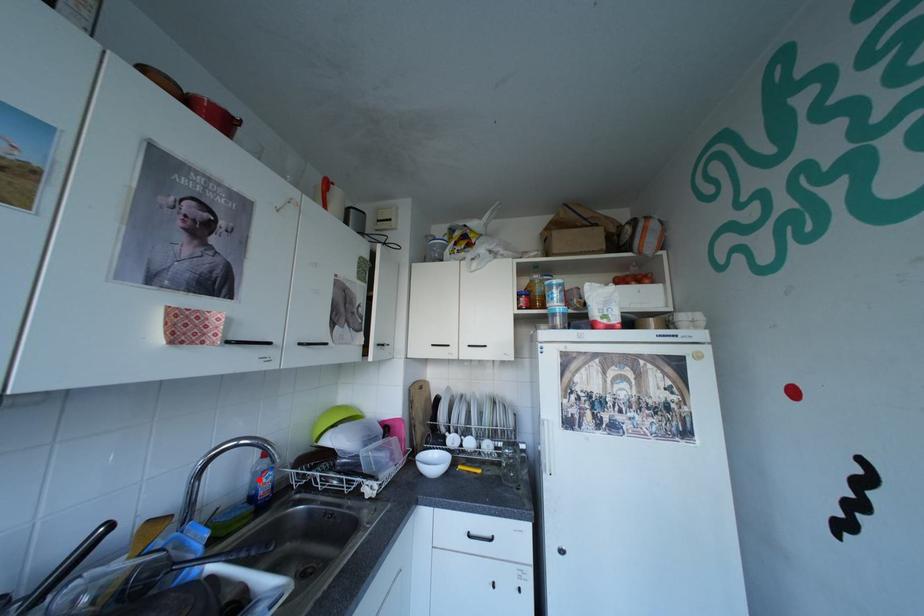
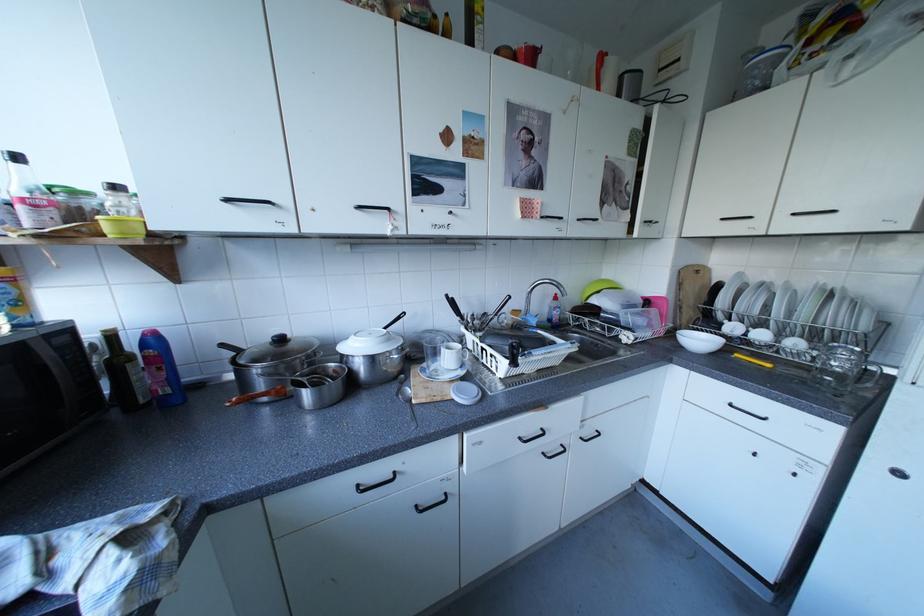
In the second image, find the point that corresponds to the highlighted location in the first image.

(558, 310)